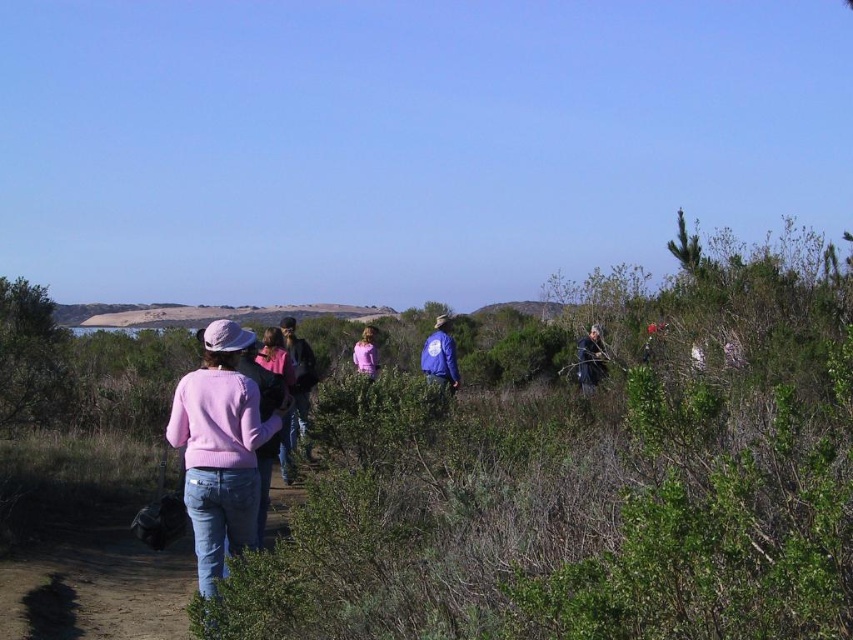
Does blue fabric jacket at center appear over pink fabric shirt at center?

No, blue fabric jacket at center is not above pink fabric shirt at center.

Locate an element on the screen. The height and width of the screenshot is (640, 853). blue fabric jacket at center is located at coordinates (440, 356).

At what (x,y) coordinates should I click in order to perform the action: click on blue fabric jacket at center. Please return your answer as a coordinate pair (x, y). This screenshot has height=640, width=853. Looking at the image, I should click on (440, 356).

Who is positioned more to the right, pink sweater at center or blue fabric jacket at center?

From the viewer's perspective, blue fabric jacket at center appears more on the right side.

Does point (212, 369) come closer to viewer compared to point (451, 387)?

That is True.

I want to click on pink sweater at center, so click(219, 449).

In the scene shown: Is blue fabric jacket at center to the right of dark brown leather jacket at right from the viewer's perspective?

Incorrect, blue fabric jacket at center is not on the right side of dark brown leather jacket at right.

Which is in front, point (439, 378) or point (585, 380)?

Point (439, 378)

Is point (439, 336) positioned before point (584, 360)?

Yes, point (439, 336) is in front of point (584, 360).

Where is `blue fabric jacket at center`? The height and width of the screenshot is (640, 853). blue fabric jacket at center is located at coordinates (440, 356).